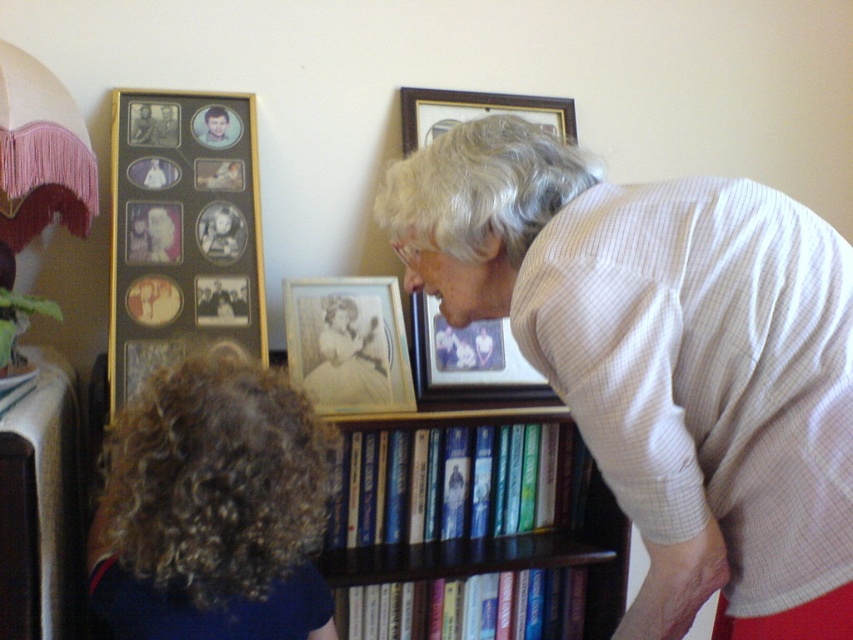
Which of these two, gold-framed photo collage at upper left or hardcover book at center, stands taller?

With more height is gold-framed photo collage at upper left.

Which is more to the right, gold-framed photo collage at upper left or hardcover book at center?

hardcover book at center

Identify the location of gold-framed photo collage at upper left. The height and width of the screenshot is (640, 853). (183, 230).

You are a GUI agent. You are given a task and a screenshot of the screen. Output one action in this format:
    pyautogui.click(x=<x>, y=<y>)
    Task: Click on the gold-framed photo collage at upper left
    
    Given the screenshot: What is the action you would take?
    pyautogui.click(x=183, y=230)

Between point (199, 611) and point (302, 291), which one is positioned behind?

Positioned behind is point (302, 291).

Locate an element on the screen. This screenshot has width=853, height=640. curly brown hair at lower left is located at coordinates (212, 509).

Is dark wood bookshelf at center below gold-framed picture at upper center?

Correct, dark wood bookshelf at center is located below gold-framed picture at upper center.

Can you confirm if dark wood bookshelf at center is smaller than gold-framed picture at upper center?

No.

Between point (469, 429) and point (425, 93), which one is positioned behind?

The point (425, 93) is more distant.

Locate an element on the screen. The image size is (853, 640). dark wood bookshelf at center is located at coordinates (473, 528).